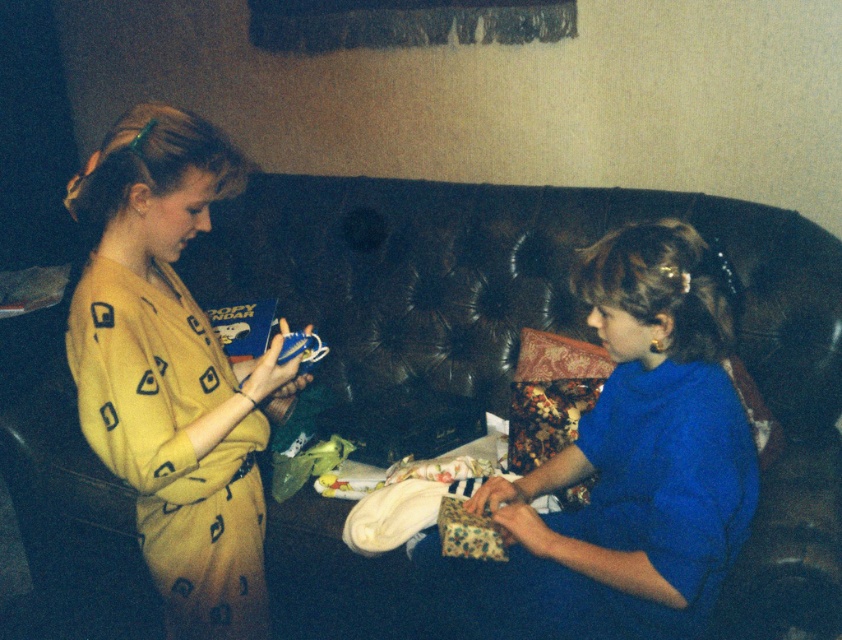
Which is behind, point (169, 241) or point (550, 577)?

Positioned behind is point (550, 577).

Can you confirm if yellow printed dress at left is wider than blue satin dress at center?

Incorrect, yellow printed dress at left's width does not surpass blue satin dress at center's.

What do you see at coordinates (172, 371) in the screenshot?
I see `yellow printed dress at left` at bounding box center [172, 371].

The height and width of the screenshot is (640, 842). What are the coordinates of `yellow printed dress at left` in the screenshot? It's located at (172, 371).

Consider the image. Who is lower down, leather couch at center or yellow printed dress at left?

leather couch at center is below.

Who is more forward, (398, 440) or (244, 460)?

Point (244, 460) is in front.

Locate an element on the screen. The width and height of the screenshot is (842, 640). leather couch at center is located at coordinates (542, 330).

Can you confirm if leather couch at center is positioned above blue satin dress at center?

Yes, leather couch at center is above blue satin dress at center.

Which is in front, point (25, 493) or point (614, 280)?

Point (614, 280) is more forward.

At what (x,y) coordinates should I click in order to perform the action: click on leather couch at center. Please return your answer as a coordinate pair (x, y). The image size is (842, 640). Looking at the image, I should click on (542, 330).